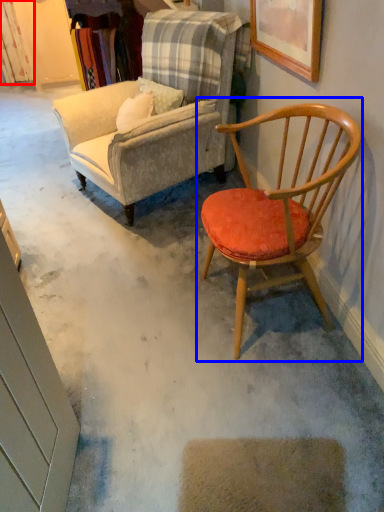
Question: Which object is closer to the camera taking this photo, curtain (highlighted by a red box) or chair (highlighted by a blue box)?

Choices:
 (A) curtain
 (B) chair

Answer: (B)